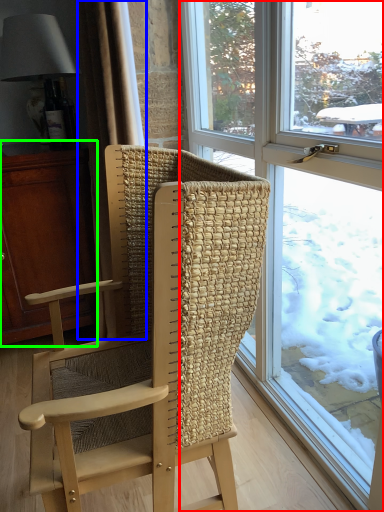
Question: Estimate the real-world distances between objects in this image. Which object is closer to window (highlighted by a red box), curtain (highlighted by a blue box) or cabinetry (highlighted by a green box)?

Choices:
 (A) curtain
 (B) cabinetry

Answer: (A)